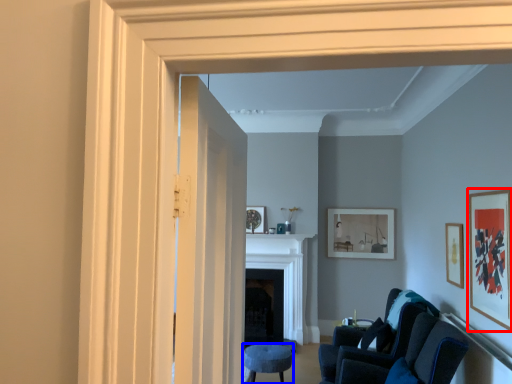
Question: Which object appears farthest to the camera in this image, picture frame (highlighted by a red box) or furniture (highlighted by a blue box)?

Choices:
 (A) picture frame
 (B) furniture

Answer: (B)